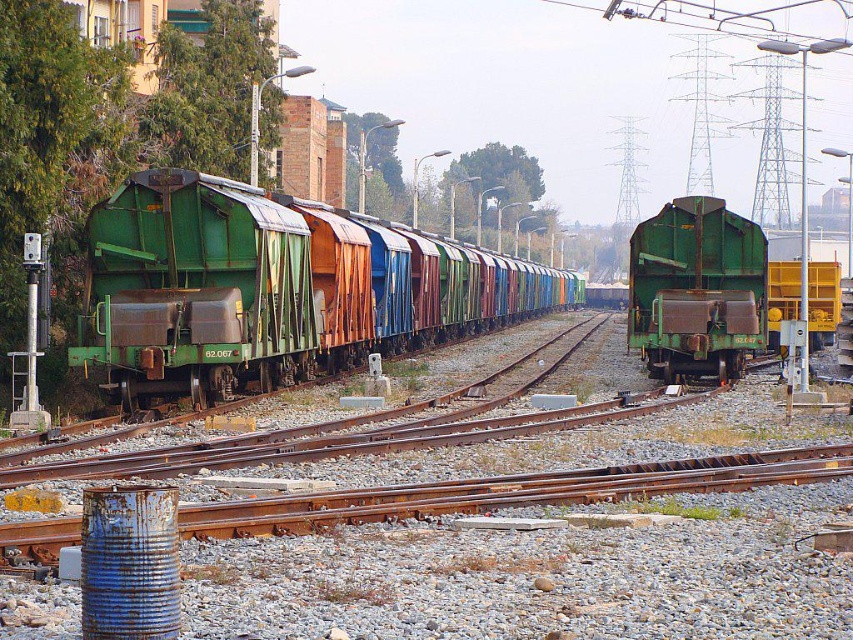
Question: Which point is farther to the camera?

Choices:
 (A) green matte train car at center
 (B) green matte train carriages at center

Answer: (A)

Question: Is green matte train carriages at center further to camera compared to green matte train car at center?

Choices:
 (A) yes
 (B) no

Answer: (B)

Question: Is green matte train carriages at center wider than green matte train car at center?

Choices:
 (A) yes
 (B) no

Answer: (A)

Question: Which point is farther from the camera taking this photo?

Choices:
 (A) (225, 323)
 (B) (646, 332)

Answer: (B)

Question: Can you confirm if green matte train carriages at center is wider than green matte train car at center?

Choices:
 (A) yes
 (B) no

Answer: (A)

Question: Which point is closer to the camera?

Choices:
 (A) (650, 364)
 (B) (151, 378)

Answer: (B)